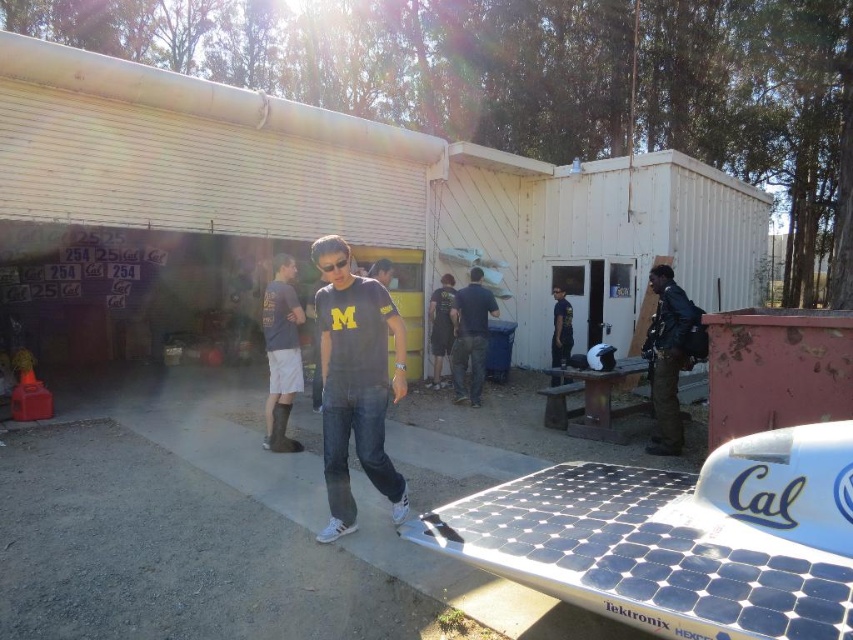
Is point (397, 486) positioned before point (469, 284)?

Yes, it is.

Who is positioned more to the left, dark blue jersey at center or dark blue shirt at center?

dark blue jersey at center

Which is behind, point (331, 307) or point (480, 272)?

Point (480, 272)

Locate an element on the screen. dark blue jersey at center is located at coordinates (355, 381).

Is dark blue jersey at center positioned at the back of black leather jacket at right?

No, it is not.

Is dark blue jersey at center below black leather jacket at right?

No.

Who is more forward, [349,502] or [654,396]?

Point [349,502] is more forward.

At what (x,y) coordinates should I click in order to perform the action: click on dark blue jersey at center. Please return your answer as a coordinate pair (x, y). Looking at the image, I should click on (355, 381).

Is black leather jacket at right above dark blue t-shirt at center?

Incorrect, black leather jacket at right is not positioned above dark blue t-shirt at center.

Who is lower down, black leather jacket at right or dark blue t-shirt at center?

black leather jacket at right is below.

Does point (685, 353) come behind point (560, 368)?

No, (685, 353) is in front of (560, 368).

Locate an element on the screen. Image resolution: width=853 pixels, height=640 pixels. black leather jacket at right is located at coordinates (666, 358).